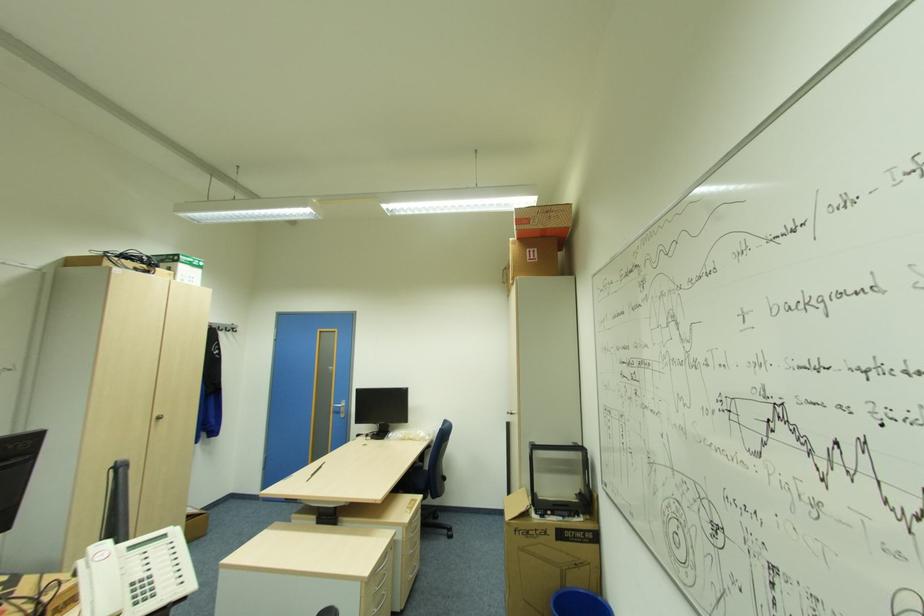
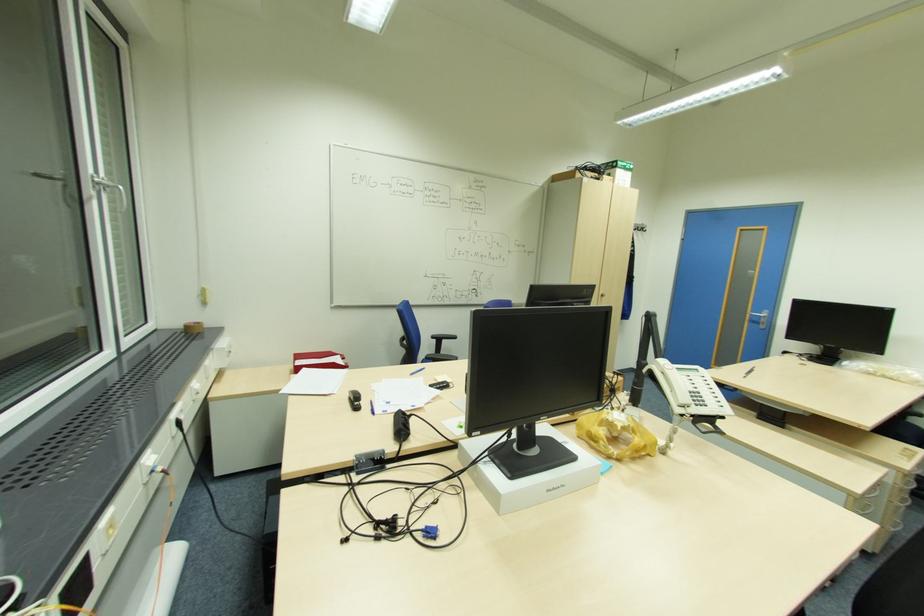
In the second image, find the point that corresponds to the point at 345,411 in the first image.

(766, 323)